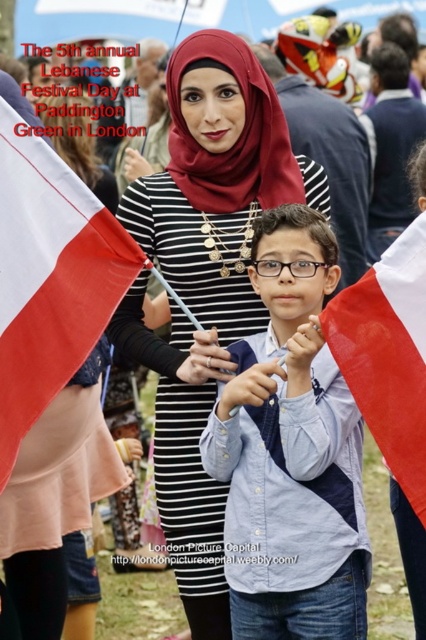
You are a photographer at the festival and want to capture both the matte black dress at center and the white fabric flag at right in the same frame. Based on their heights, which object should you focus on first to ensure both are in focus?

The matte black dress at center is taller than the white fabric flag at right, so you should focus on the matte black dress at center first to ensure both are in focus.

You are a photographer at the festival and want to capture both the matte black dress at center and the white fabric flag at left in a single photo. Since you can adjust your camera angle, which object should you focus on first to ensure both are in frame?

The matte black dress at center is taller than the white fabric flag at left, so you should focus on the matte black dress at center first to ensure both are in frame.